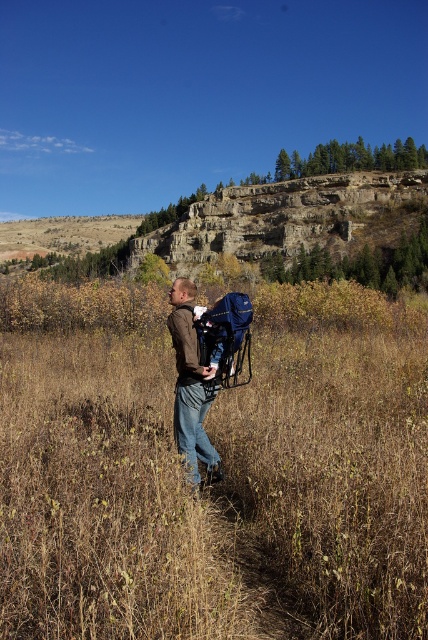
Question: Which of the following is the closest to the observer?

Choices:
 (A) brown leather jacket at center
 (B) brown dry grass at center

Answer: (B)

Question: Is brown dry grass at center above brown leather jacket at center?

Choices:
 (A) yes
 (B) no

Answer: (A)

Question: Which object appears closest to the camera in this image?

Choices:
 (A) brown leather jacket at center
 (B) brown dry grass at center

Answer: (B)

Question: Which object is farther from the camera taking this photo?

Choices:
 (A) brown dry grass at center
 (B) brown leather jacket at center

Answer: (B)

Question: Can you confirm if brown dry grass at center is bigger than brown leather jacket at center?

Choices:
 (A) no
 (B) yes

Answer: (B)

Question: Does brown dry grass at center have a lesser width compared to brown leather jacket at center?

Choices:
 (A) no
 (B) yes

Answer: (A)